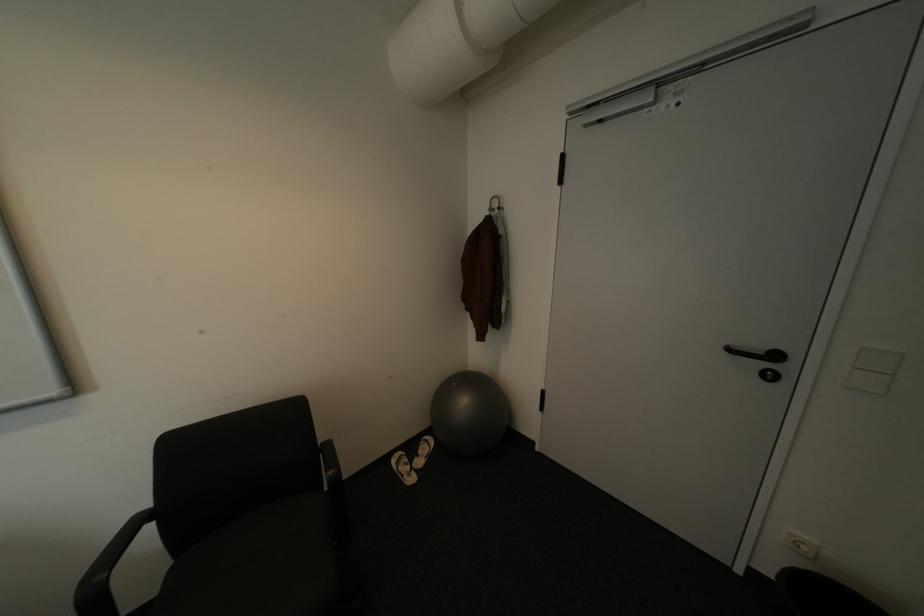
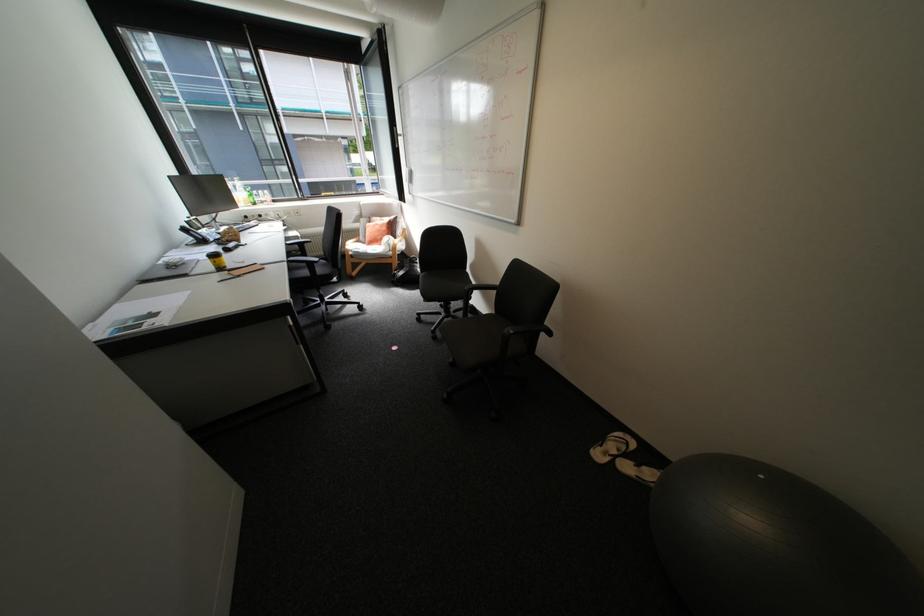
In the second image, find the point that corresponds to pixel 464 384 in the first image.

(772, 477)